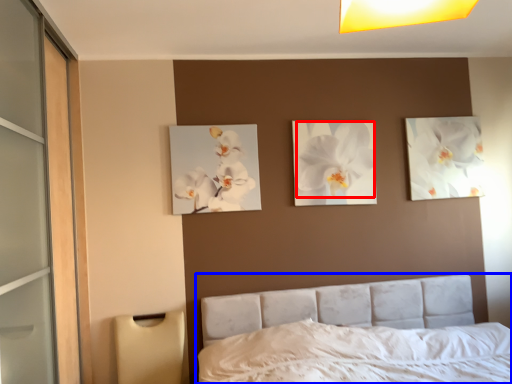
Question: Which object appears farthest to the camera in this image, flower (highlighted by a red box) or bed (highlighted by a blue box)?

Choices:
 (A) flower
 (B) bed

Answer: (A)